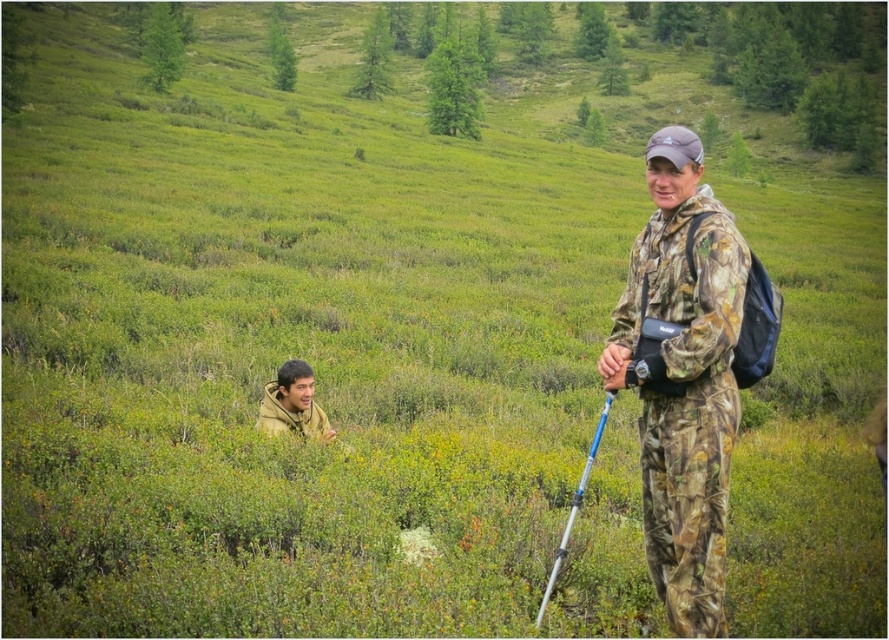
You are a park ranger trying to locate the camouflage jacket at lower left in the image. The coordinates provided are point (292, 403). Can you confirm if this point accurately marks the location of the camouflage jacket at lower left?

Yes, the point (292, 403) corresponds to the camouflage jacket at lower left as stated in the description.